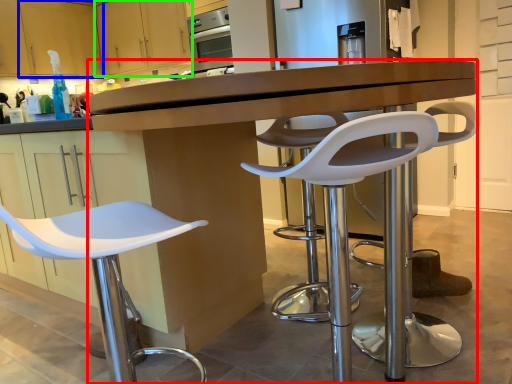
Question: Which object is positioned closest to desk (highlighted by a red box)? Select from cabinetry (highlighted by a blue box) and cabinetry (highlighted by a green box).

Choices:
 (A) cabinetry
 (B) cabinetry

Answer: (B)